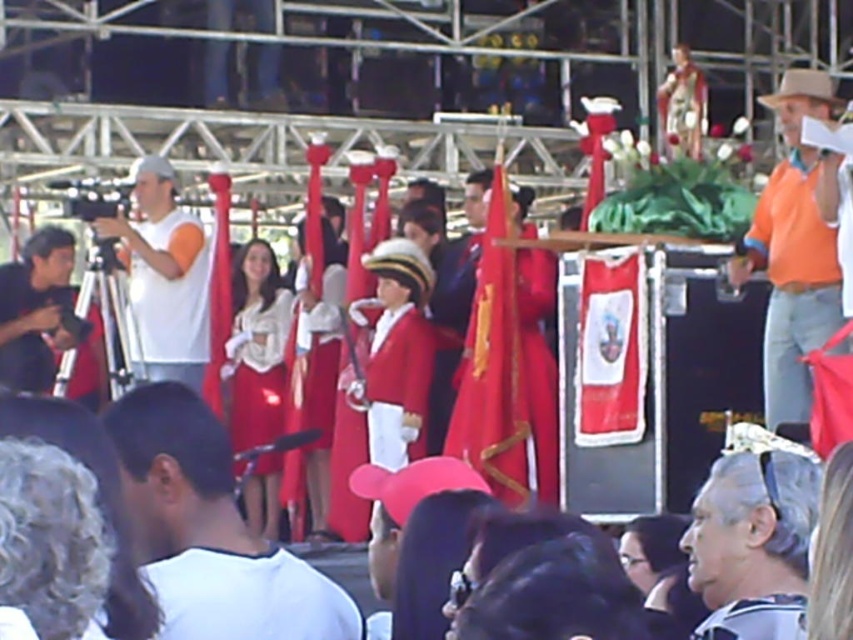
You are a photographer at the event and want to capture both the shiny blue suit at center and the brown leather cowboy hat at upper right in your shot. Which object is narrower so you can frame them appropriately?

The shiny blue suit at center is narrower than the brown leather cowboy hat at upper right, so you should frame the shot to accommodate the narrower width of the shiny blue suit at center while still including the brown leather cowboy hat at upper right.

You are a photographer standing at the back of the event. You want to take a photo that includes both the matte white blouse at center and the brown leather cowboy hat at upper right. Considering their distance apart, will you need to zoom in or out to frame both subjects properly?

The matte white blouse at center is 75.46 feet away from the brown leather cowboy hat at upper right. To frame both subjects properly, you would need to zoom out to capture the entire distance between them in the photo.